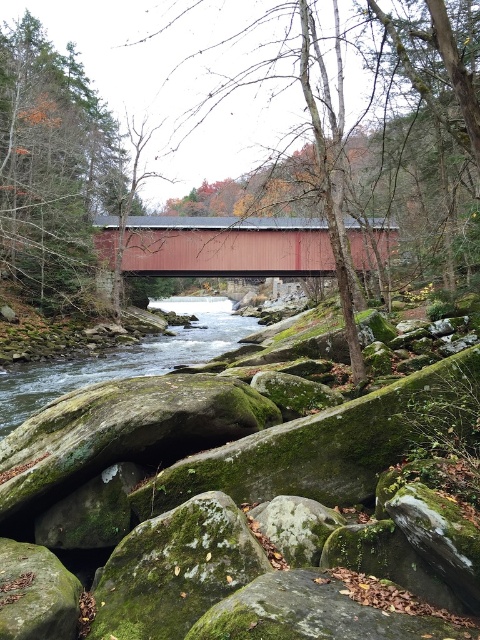
Does matte red bridge at center have a greater height compared to smooth bark tree at center?

No, matte red bridge at center is not taller than smooth bark tree at center.

Between point (295, 268) and point (311, 108), which one is positioned in front?

Positioned in front is point (311, 108).

Locate an element on the screen. matte red bridge at center is located at coordinates (227, 246).

Based on the photo, does green mossy rock at left have a smaller size compared to smooth bark tree at center?

Correct, green mossy rock at left occupies less space than smooth bark tree at center.

Is point (4, 120) closer to camera compared to point (463, 93)?

No, (4, 120) is further to viewer.

Which is in front, point (71, 273) or point (465, 92)?

Positioned in front is point (465, 92).

The width and height of the screenshot is (480, 640). In order to click on green mossy rock at left in this screenshot , I will do `click(50, 163)`.

Does green mossy rock at left appear on the left side of green mossy rock at lower left?

Indeed, green mossy rock at left is positioned on the left side of green mossy rock at lower left.

Find the location of a particular element. The height and width of the screenshot is (640, 480). green mossy rock at left is located at coordinates (50, 163).

What do you see at coordinates (50, 163) in the screenshot?
I see `green mossy rock at left` at bounding box center [50, 163].

Where is `green mossy rock at left`? The width and height of the screenshot is (480, 640). green mossy rock at left is located at coordinates (50, 163).